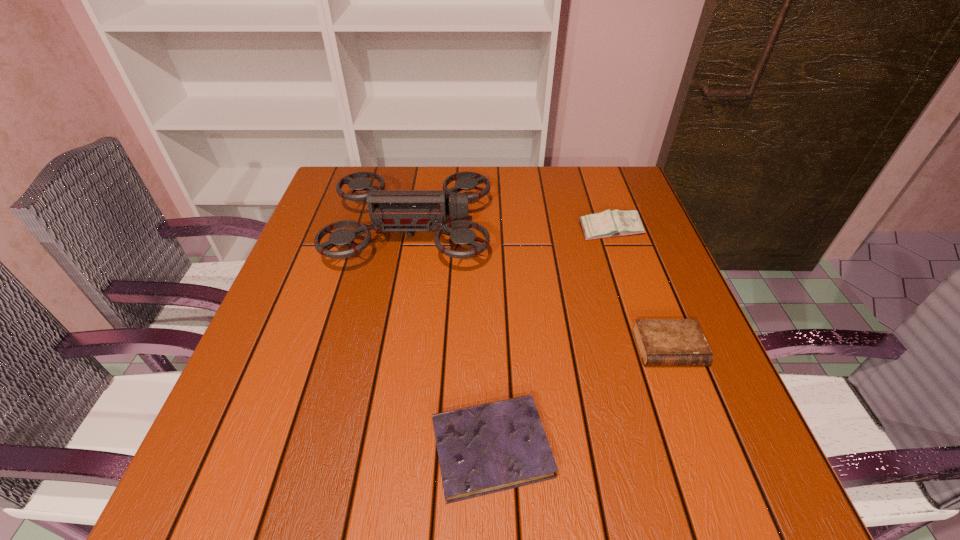
The width and height of the screenshot is (960, 540). I want to click on the tallest object, so click(x=394, y=210).

The image size is (960, 540). Identify the location of the tallest diary. (616, 223).

Identify the location of the farthest diary. The height and width of the screenshot is (540, 960). (616, 223).

Where is `the second nearest object`? The height and width of the screenshot is (540, 960). the second nearest object is located at coordinates (661, 342).

You are a GUI agent. You are given a task and a screenshot of the screen. Output one action in this format:
    pyautogui.click(x=<x>, y=<y>)
    Task: Click on the second shortest object
    This screenshot has width=960, height=540.
    Given the screenshot: What is the action you would take?
    pyautogui.click(x=661, y=342)

Locate an element on the screen. This screenshot has width=960, height=540. the shortest diary is located at coordinates (487, 448).

Where is `the nearest object`? The image size is (960, 540). the nearest object is located at coordinates (487, 448).

This screenshot has height=540, width=960. What are the coordinates of `free space located on the front-facing side of the tallest object` in the screenshot? It's located at (542, 232).

At what (x,y) coordinates should I click in order to perform the action: click on vacant space situated 0.300m on the left of the farthest diary. Please return your answer as a coordinate pair (x, y). This screenshot has width=960, height=540. Looking at the image, I should click on (461, 230).

This screenshot has height=540, width=960. What are the coordinates of `vacant point located on the spine side of the second shortest diary` in the screenshot? It's located at (689, 403).